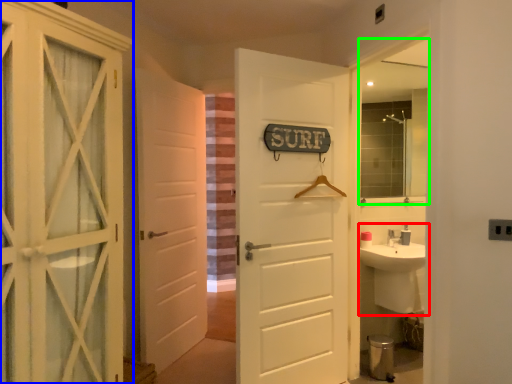
Question: Which object is the closest to the sink (highlighted by a red box)? Choose among these: door (highlighted by a blue box) or mirror (highlighted by a green box).

Choices:
 (A) door
 (B) mirror

Answer: (B)